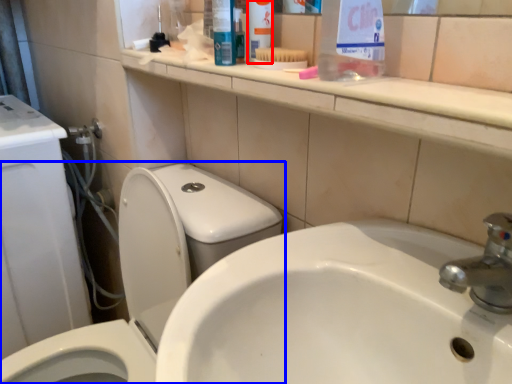
Question: Which point is further to the camera, toiletry (highlighted by a red box) or toilet (highlighted by a blue box)?

Choices:
 (A) toiletry
 (B) toilet

Answer: (A)